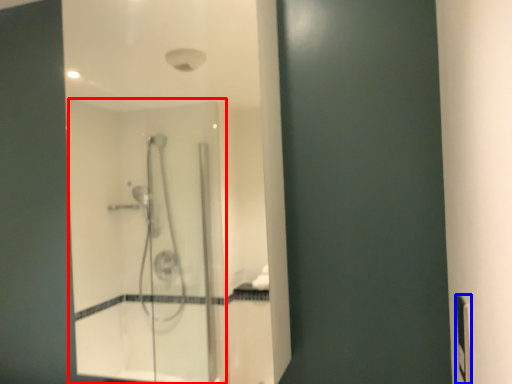
Question: Which object is further to the camera taking this photo, screen door (highlighted by a red box) or electric outlet (highlighted by a blue box)?

Choices:
 (A) screen door
 (B) electric outlet

Answer: (A)